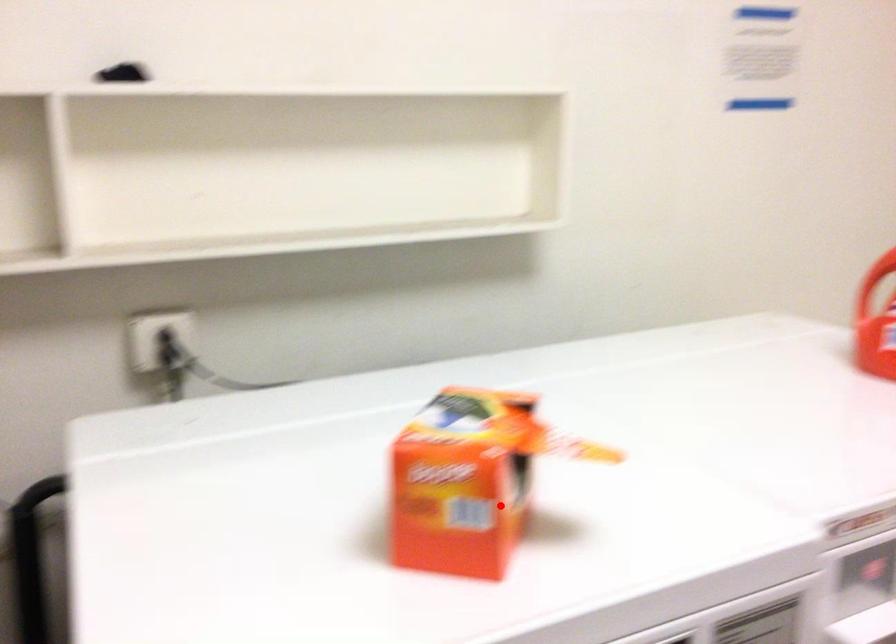
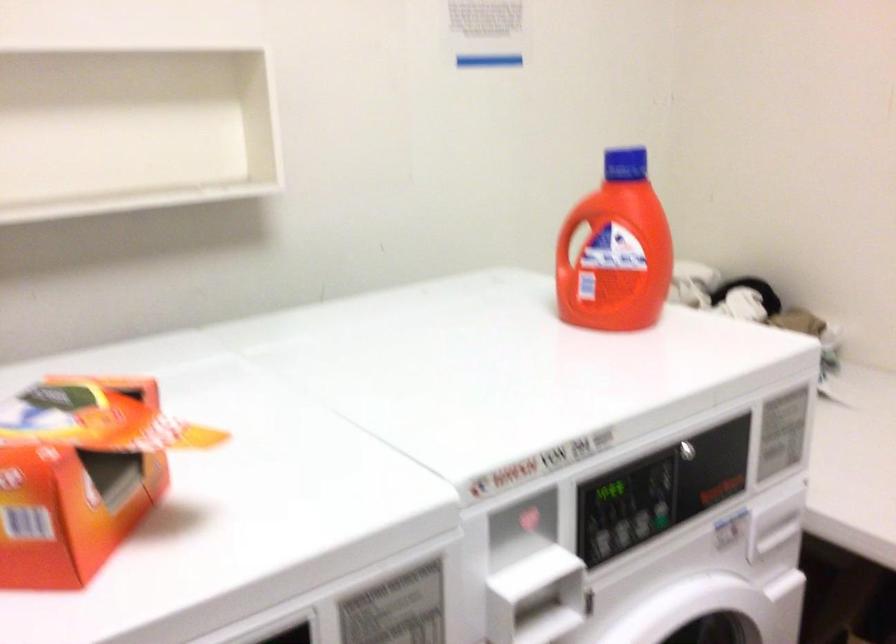
Locate, in the second image, the point that corresponds to the highlighted location in the first image.

(73, 498)